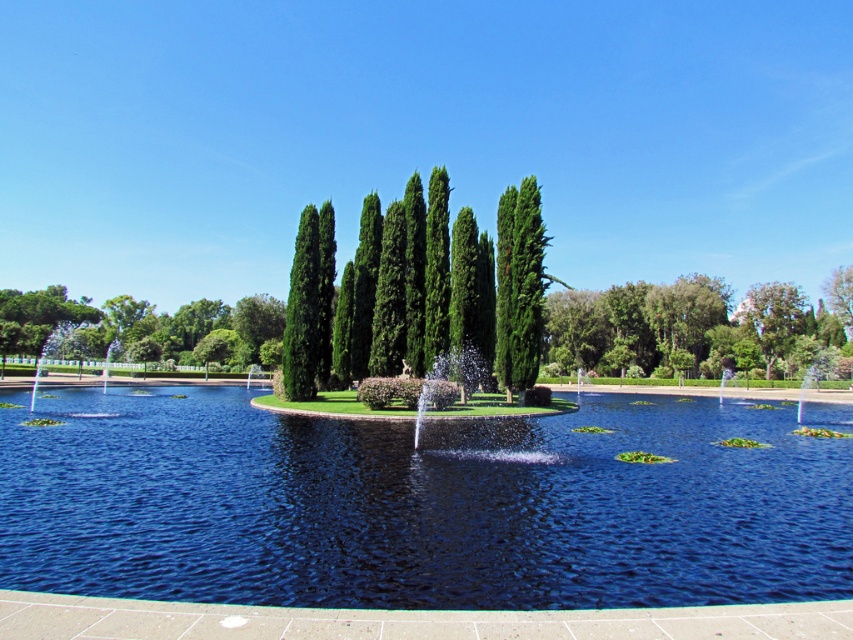
You are standing at the edge of the park facing the water. You see the green glossy tree at upper center and the white glossy fountain at left. Which object is positioned more to your left?

The white glossy fountain at left is more to the left because the green glossy tree at upper center is to the left of it.

You are a park visitor standing at the edge of the clear blue water at center and want to take a photo of the green glossy tree at upper center. Which direction should you face to capture the tree in your view?

The clear blue water at center is positioned on the right side of green glossy tree at upper center, so you should face to the left to capture the tree in your view.

You are planning to install a floating walkway in the park. The walkway needs to be 40 meters long to connect the main shore to the island. Based on the distance between the clear blue water at center and the green leafy tree at center, will the walkway be long enough?

The clear blue water at center and green leafy tree at center are 39.34 meters apart. Since the walkway is 40 meters long, it will be long enough to connect the main shore to the island.